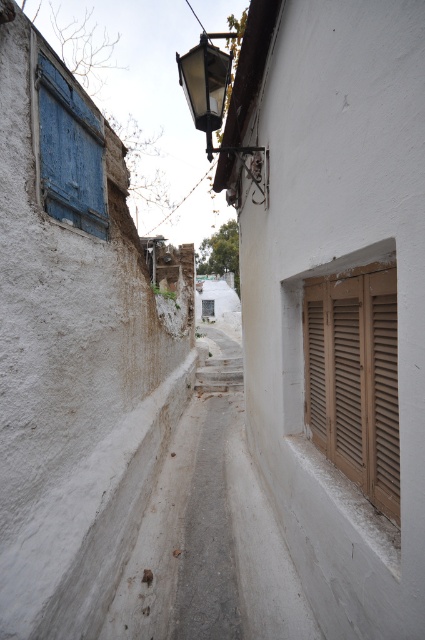
You are walking through the alleyway and notice the blue painted wood at left and the matte black lamp at upper center. Which object is taller?

The blue painted wood at left is taller than the matte black lamp at upper center.

You are a painter who needs to place a 1.2 meter long ladder between the blue painted wood at left and the matte black lamp at upper center. Can the ladder fit horizontally between them without touching either object?

The distance between the blue painted wood at left and the matte black lamp at upper center is 67.77 centimeters. Since the ladder is 1.2 meters long, which is significantly longer than the available space, the ladder cannot fit horizontally between them without touching either object.